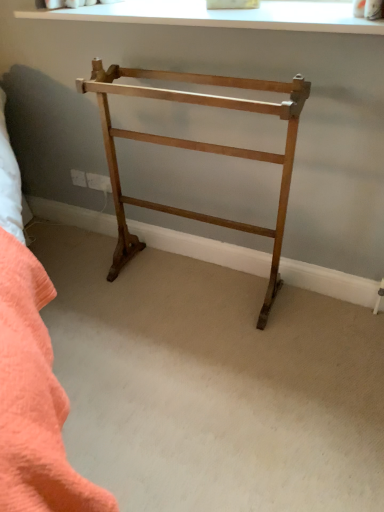
Question: Is light brown wood towel rack at center far from white smooth window at upper center?

Choices:
 (A) no
 (B) yes

Answer: (A)

Question: From the image's perspective, would you say light brown wood towel rack at center is positioned over white smooth window at upper center?

Choices:
 (A) yes
 (B) no

Answer: (B)

Question: Is light brown wood towel rack at center at the right side of white smooth window at upper center?

Choices:
 (A) no
 (B) yes

Answer: (A)

Question: From a real-world perspective, is light brown wood towel rack at center positioned over white smooth window at upper center based on gravity?

Choices:
 (A) no
 (B) yes

Answer: (A)

Question: Can white smooth window at upper center be found inside light brown wood towel rack at center?

Choices:
 (A) yes
 (B) no

Answer: (B)

Question: Is light brown wood towel rack at center not within white smooth window at upper center?

Choices:
 (A) yes
 (B) no

Answer: (A)

Question: Is white smooth window at upper center aimed at light brown wood towel rack at center?

Choices:
 (A) yes
 (B) no

Answer: (B)

Question: Is light brown wood towel rack at center inside white smooth window at upper center?

Choices:
 (A) no
 (B) yes

Answer: (A)

Question: From a real-world perspective, is white smooth window at upper center physically above light brown wood towel rack at center?

Choices:
 (A) no
 (B) yes

Answer: (B)

Question: Is white smooth window at upper center far from light brown wood towel rack at center?

Choices:
 (A) no
 (B) yes

Answer: (A)

Question: Does white smooth window at upper center have a greater height compared to light brown wood towel rack at center?

Choices:
 (A) yes
 (B) no

Answer: (B)

Question: Does white smooth window at upper center have a larger size compared to light brown wood towel rack at center?

Choices:
 (A) no
 (B) yes

Answer: (A)

Question: From a real-world perspective, is white smooth window at upper center positioned above or below light brown wood towel rack at center?

Choices:
 (A) below
 (B) above

Answer: (B)